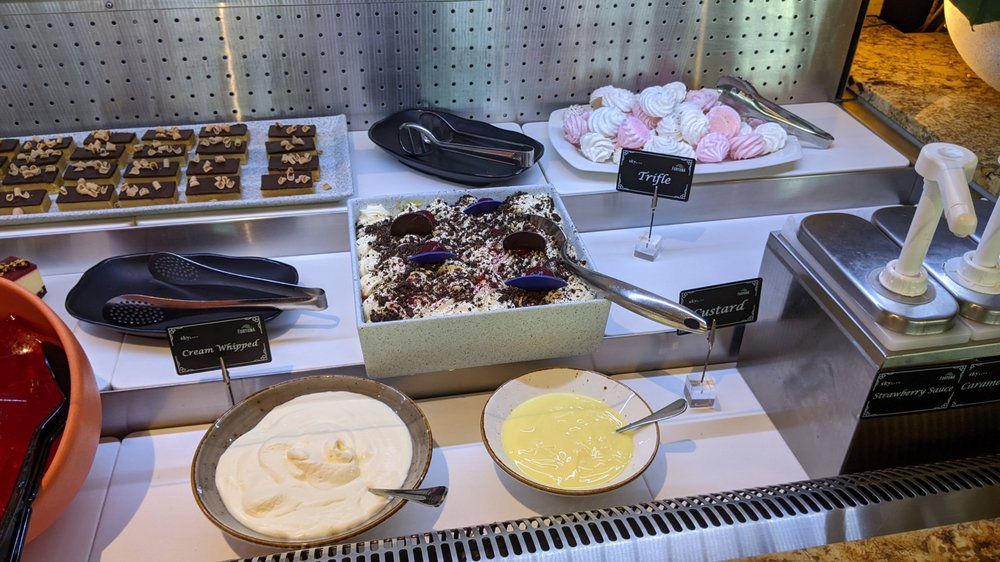
Identify the location of black bowls. The height and width of the screenshot is (562, 1000). (142, 328), (446, 176).